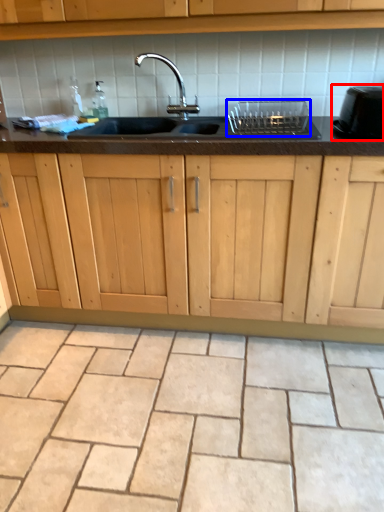
Question: Which point is closer to the camera, appliance (highlighted by a red box) or appliance (highlighted by a blue box)?

Choices:
 (A) appliance
 (B) appliance

Answer: (A)